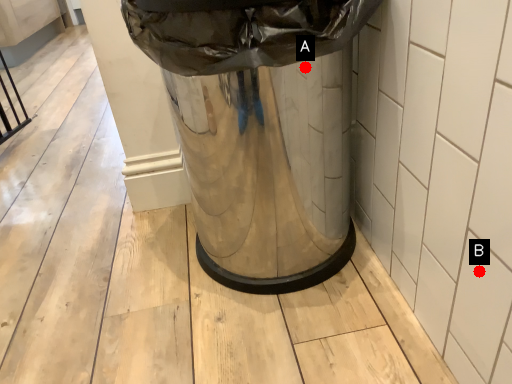
Question: Two points are circled on the image, labeled by A and B beside each circle. Which point is farther from the camera taking this photo?

Choices:
 (A) A is further
 (B) B is further

Answer: (A)